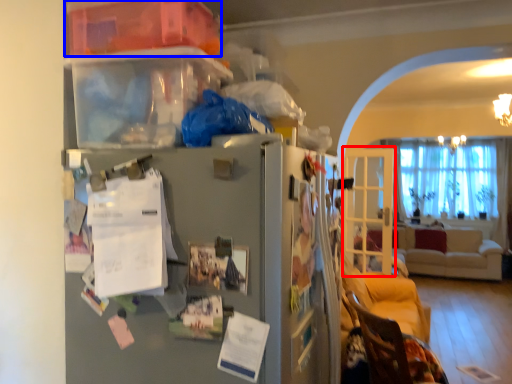
Question: Which of the following is the closest to the observer, glass door (highlighted by a red box) or storage box (highlighted by a blue box)?

Choices:
 (A) glass door
 (B) storage box

Answer: (B)